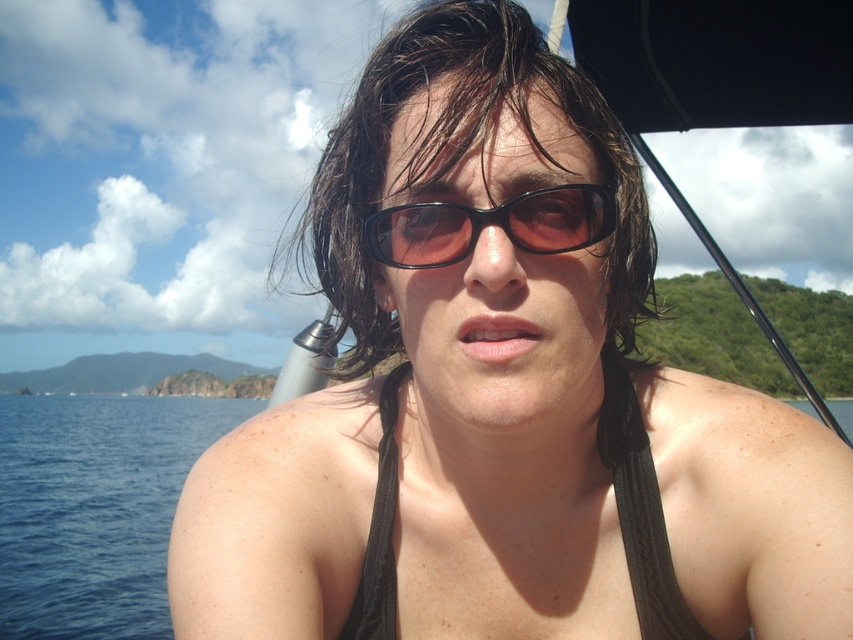
What are the coordinates of the wet dark brown hair at center?

The wet dark brown hair at center is located at point (451, 168).

You are a photographer trying to capture the reflection of the black plastic sunglasses at center in the transparent water at center. Based on the scene, can you confirm if the reflection will be fully visible in the water?

The transparent water at center has a larger size compared to black plastic sunglasses at center, so the reflection of the black plastic sunglasses at center will be fully visible in the transparent water at center since the water surface is large enough to accommodate the sunglasses.

You are a photographer trying to capture the reflection of the wet dark brown hair at center and the black plastic sunglasses at center in the water below. Which object will have a clearer reflection?

The wet dark brown hair at center will have a clearer reflection because it is closer to the water surface than the black plastic sunglasses at center.